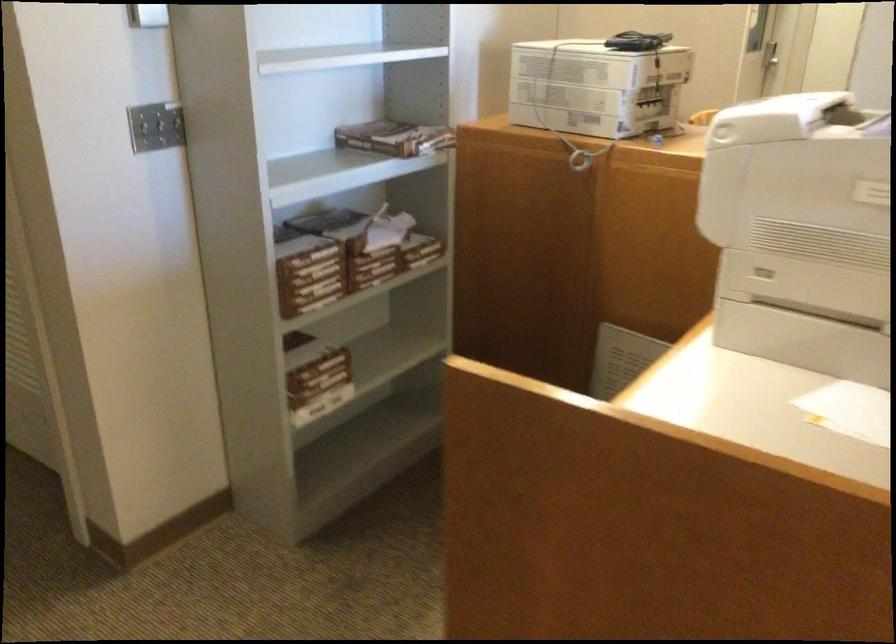
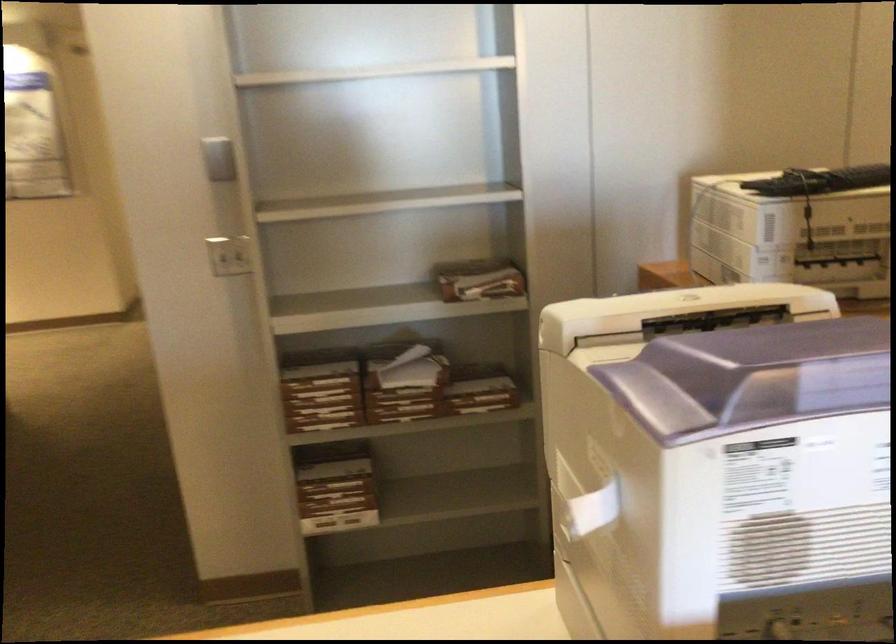
Where in the second image is the point corresponding to (x=367, y=252) from the first image?

(398, 389)